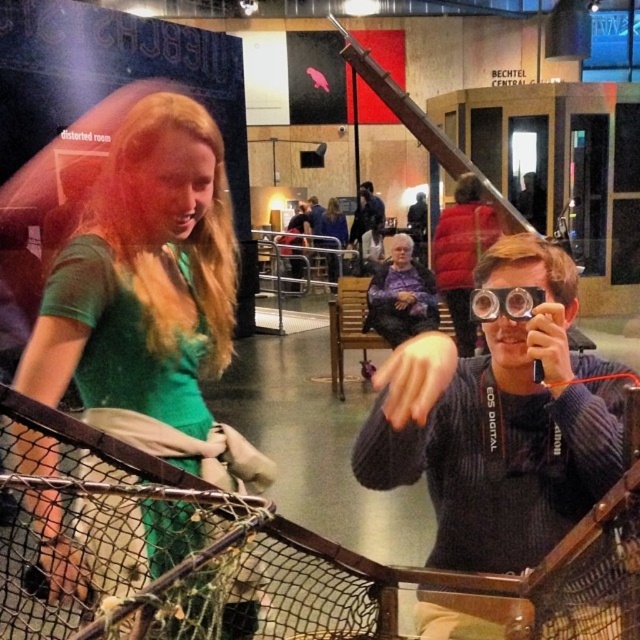
Does green matte shirt at center lie behind purple fabric at center?

No, it is not.

Does point (97, 294) come in front of point (396, 307)?

Yes, it is.

Where is `green matte shirt at center`? This screenshot has height=640, width=640. green matte shirt at center is located at coordinates (148, 296).

Find the location of a particular element. This screenshot has height=640, width=640. green matte shirt at center is located at coordinates (148, 296).

Is red puffer coat at center to the right of purple fabric at center from the viewer's perspective?

Correct, you'll find red puffer coat at center to the right of purple fabric at center.

Which is in front, point (440, 266) or point (384, 273)?

Point (384, 273) is more forward.

Who is more distant from viewer, [499,227] or [387,289]?

Positioned behind is point [499,227].

This screenshot has width=640, height=640. I want to click on red puffer coat at center, so click(x=461, y=253).

Can you confirm if green matte shirt at center is taller than red puffer coat at center?

Incorrect, green matte shirt at center's height is not larger of red puffer coat at center's.

Does point (227, 273) lie behind point (452, 243)?

No, (227, 273) is closer to viewer.

Who is more distant from viewer, [160,164] or [481,228]?

The point [481,228] is more distant.

Find the location of a particular element. Image resolution: width=640 pixels, height=640 pixels. green matte shirt at center is located at coordinates (148, 296).